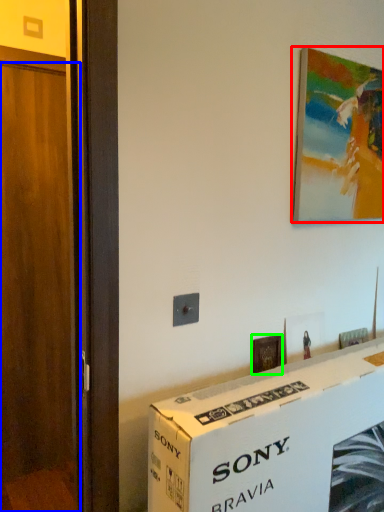
Question: Which object is positioned closest to picture frame (highlighted by a red box)? Select from door (highlighted by a blue box) and picture frame (highlighted by a green box).

Choices:
 (A) door
 (B) picture frame

Answer: (B)